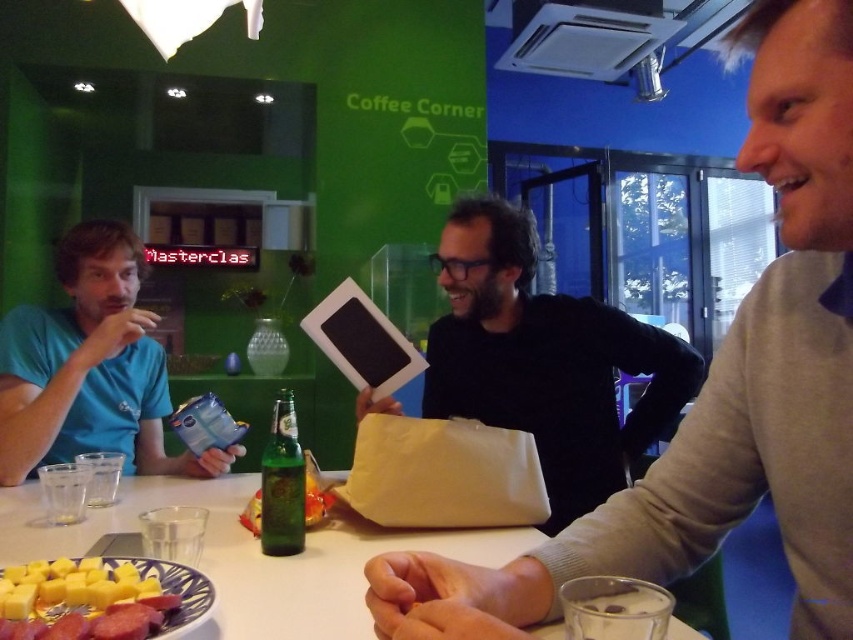
Is yellow cheese cubes at lower left further to the viewer compared to green glass bottle at center?

No, yellow cheese cubes at lower left is closer to the viewer.

Is yellow cheese cubes at lower left above green glass bottle at center?

No, yellow cheese cubes at lower left is not above green glass bottle at center.

Between point (35, 630) and point (263, 461), which one is positioned behind?

The point (263, 461) is more distant.

The height and width of the screenshot is (640, 853). Find the location of `yellow cheese cubes at lower left`. yellow cheese cubes at lower left is located at coordinates (82, 600).

Is blue matte t-shirt at left further to camera compared to green glass bottle at center?

Yes.

At what (x,y) coordinates should I click in order to perform the action: click on blue matte t-shirt at left. Please return your answer as a coordinate pair (x, y). Looking at the image, I should click on (90, 368).

Does point (82, 333) come behind point (286, 444)?

Yes.

I want to click on blue matte t-shirt at left, so pyautogui.click(x=90, y=368).

Who is lower down, blue matte t-shirt at left or yellow cheese cubes at lower left?

yellow cheese cubes at lower left

Does blue matte t-shirt at left have a greater height compared to yellow cheese cubes at lower left?

Correct, blue matte t-shirt at left is much taller as yellow cheese cubes at lower left.

Where is `blue matte t-shirt at left`? blue matte t-shirt at left is located at coordinates (90, 368).